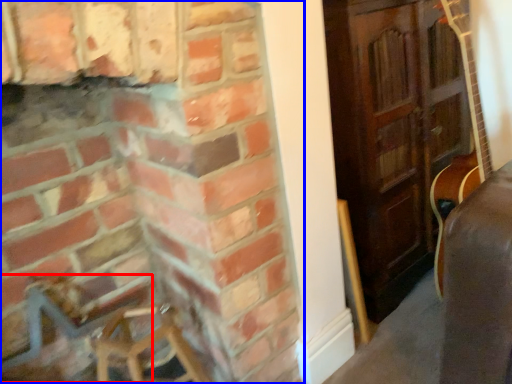
Question: Which point is further to the camera, armchair (highlighted by a red box) or fireplace (highlighted by a blue box)?

Choices:
 (A) armchair
 (B) fireplace

Answer: (A)